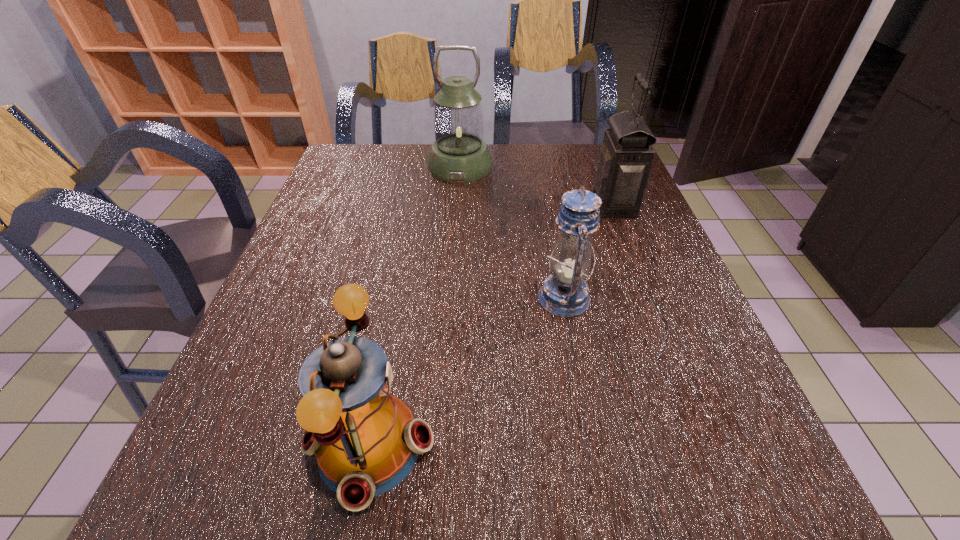
You are a GUI agent. You are given a task and a screenshot of the screen. Output one action in this format:
    pyautogui.click(x=<x>, y=<y>)
    Task: Click on the free spot located 0.340m on the front-facing side of the third object from left to right
    The image size is (960, 540).
    Given the screenshot: What is the action you would take?
    pyautogui.click(x=376, y=298)

The width and height of the screenshot is (960, 540). In order to click on free point located 0.390m on the front-facing side of the third object from left to right in this screenshot , I will do `click(353, 298)`.

Locate an element on the screen. This screenshot has width=960, height=540. vacant space located 0.250m on the front-facing side of the third object from left to right is located at coordinates (420, 298).

Locate an element on the screen. free region located 0.280m on the front-facing side of the nearest object is located at coordinates (612, 446).

I want to click on object located in the far edge section of the desktop, so click(459, 154).

Where is `object that is at the near edge`? object that is at the near edge is located at coordinates (366, 441).

Where is `object that is at the right edge`? The height and width of the screenshot is (540, 960). object that is at the right edge is located at coordinates (626, 156).

Find the location of a particular element. free space at the far edge is located at coordinates (487, 175).

Where is `vacant space at the near edge of the desktop`? The image size is (960, 540). vacant space at the near edge of the desktop is located at coordinates (664, 482).

Identify the location of vacant space at the left edge of the desktop. The width and height of the screenshot is (960, 540). (258, 380).